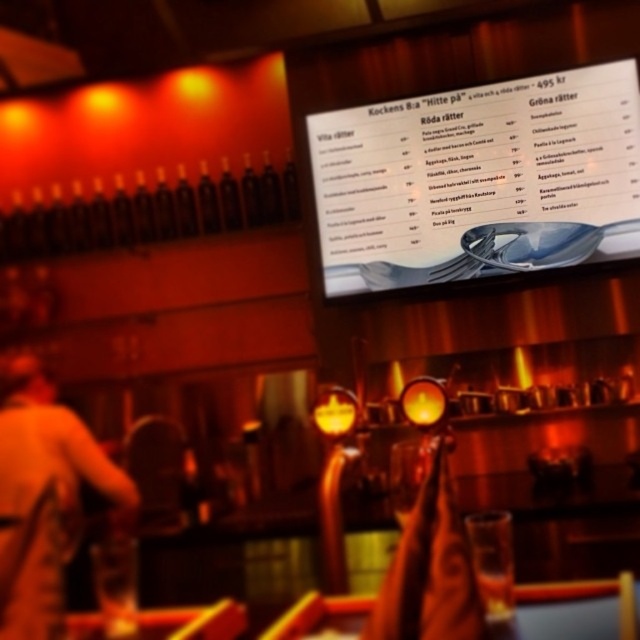
Is white glossy menu at center thinner than light brown leather jacket at lower left?

Incorrect, white glossy menu at center's width is not less than light brown leather jacket at lower left's.

In order to click on white glossy menu at center in this screenshot , I will do `click(477, 180)`.

This screenshot has width=640, height=640. Find the location of `white glossy menu at center`. white glossy menu at center is located at coordinates (477, 180).